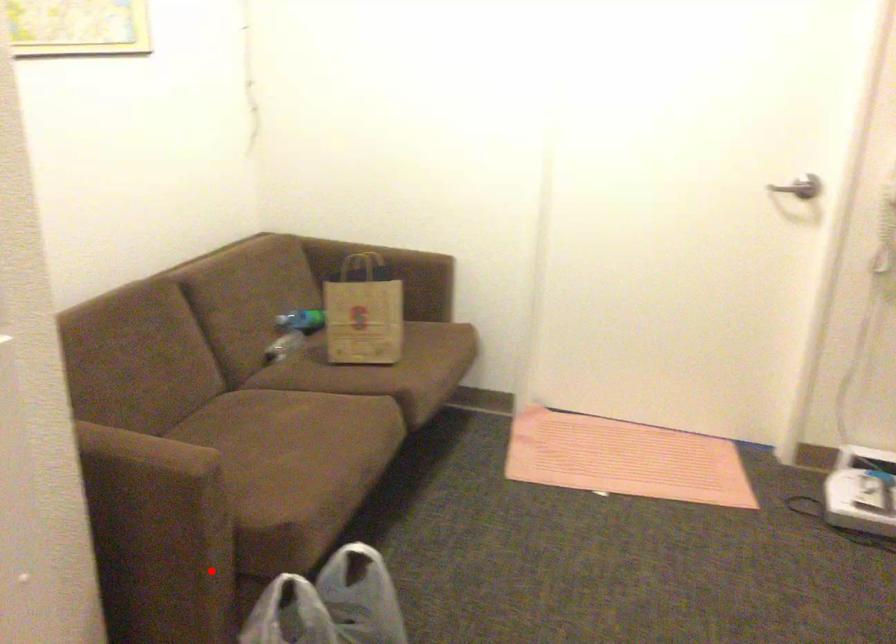
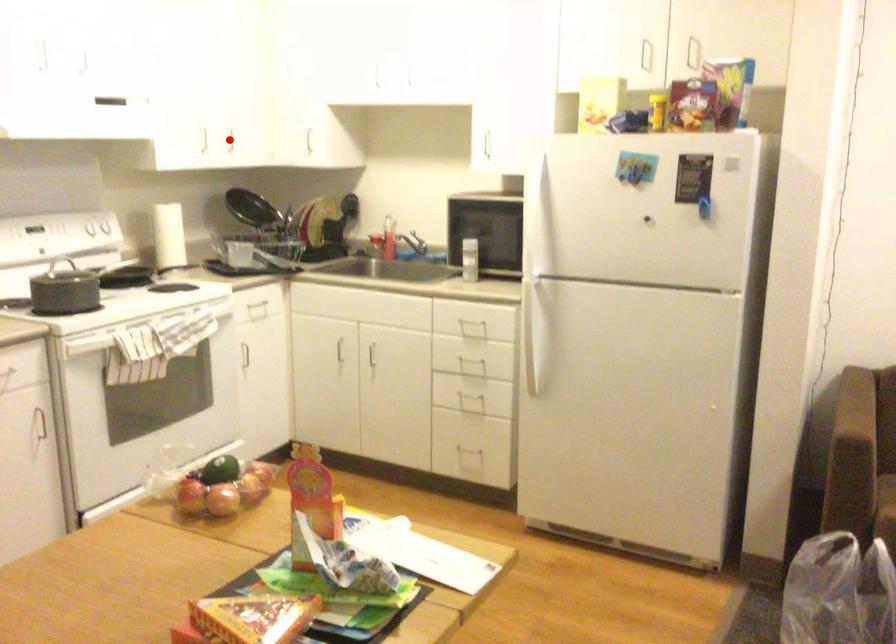
I am providing you with two images of the same scene from different viewpoints. A red point is marked on the first image and another point is marked on the second image. Is the marked point in image1 the same physical position as the marked point in image2?

No